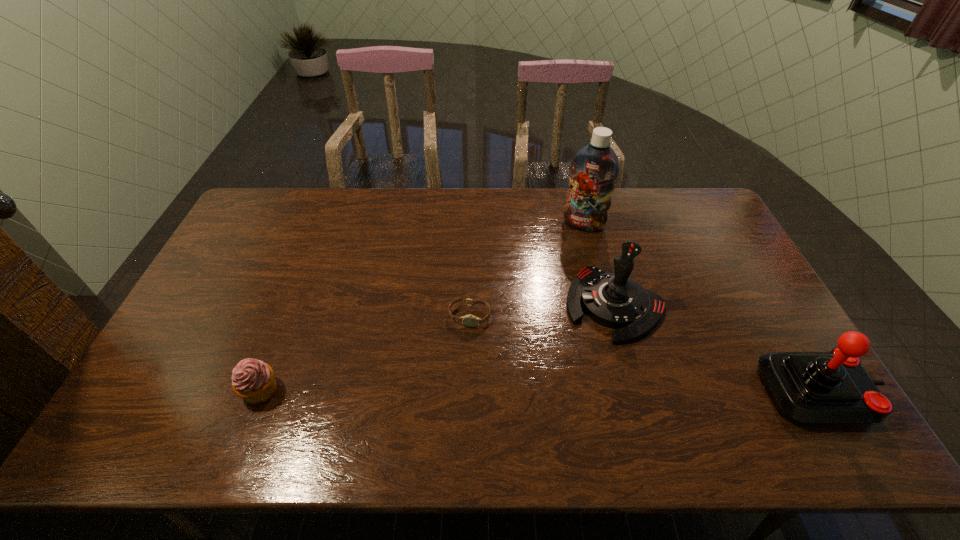
The image size is (960, 540). Identify the location of the leftmost object. (253, 380).

The image size is (960, 540). I want to click on the second shortest object, so click(253, 380).

Identify the location of the right joystick. The width and height of the screenshot is (960, 540). (832, 387).

This screenshot has width=960, height=540. Find the location of `the rightmost object`. the rightmost object is located at coordinates [832, 387].

Identify the location of the farthest object. This screenshot has height=540, width=960. (594, 168).

At what (x,y) coordinates should I click in order to perform the action: click on shampoo. Please return your answer as a coordinate pair (x, y). Looking at the image, I should click on (594, 168).

Locate an element on the screen. Image resolution: width=960 pixels, height=540 pixels. the left joystick is located at coordinates (614, 300).

Identify the location of watch. (469, 320).

The height and width of the screenshot is (540, 960). In order to click on the shortest object in this screenshot , I will do `click(469, 320)`.

The height and width of the screenshot is (540, 960). Find the location of `vacant space located on the back of the second shortest object`. vacant space located on the back of the second shortest object is located at coordinates (284, 327).